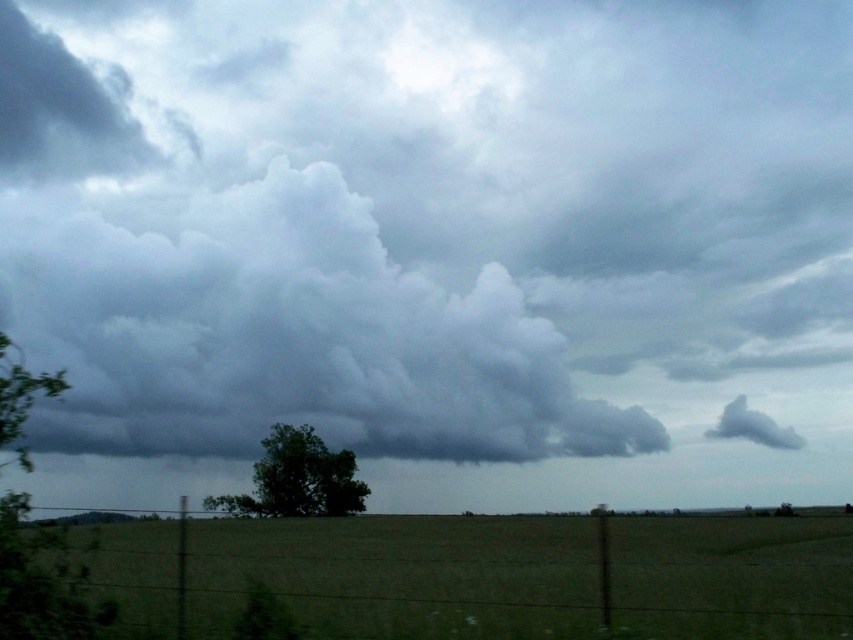
Between green leafy tree at left and gray fluffy cloud at upper right, which one has less height?

gray fluffy cloud at upper right is shorter.

Can you confirm if green leafy tree at left is bigger than gray fluffy cloud at upper right?

Indeed, green leafy tree at left has a larger size compared to gray fluffy cloud at upper right.

Is point (39, 388) closer to camera compared to point (769, 428)?

Yes, it is.

Where is `green leafy tree at left`? This screenshot has height=640, width=853. green leafy tree at left is located at coordinates (42, 582).

Can you confirm if green grass at lower center is wider than green leafy tree at center?

Correct, the width of green grass at lower center exceeds that of green leafy tree at center.

Between green grass at lower center and green leafy tree at center, which one has less height?

Standing shorter between the two is green leafy tree at center.

Find the location of a particular element. green grass at lower center is located at coordinates (401, 576).

Which is more to the left, green leafy tree at left or green leafy tree at center?

green leafy tree at center is more to the left.

Can you confirm if green leafy tree at left is shorter than green leafy tree at center?

Yes, green leafy tree at left is shorter than green leafy tree at center.

Is point (1, 522) less distant than point (281, 492)?

Yes.

Where is `green leafy tree at left`? This screenshot has width=853, height=640. green leafy tree at left is located at coordinates (42, 582).